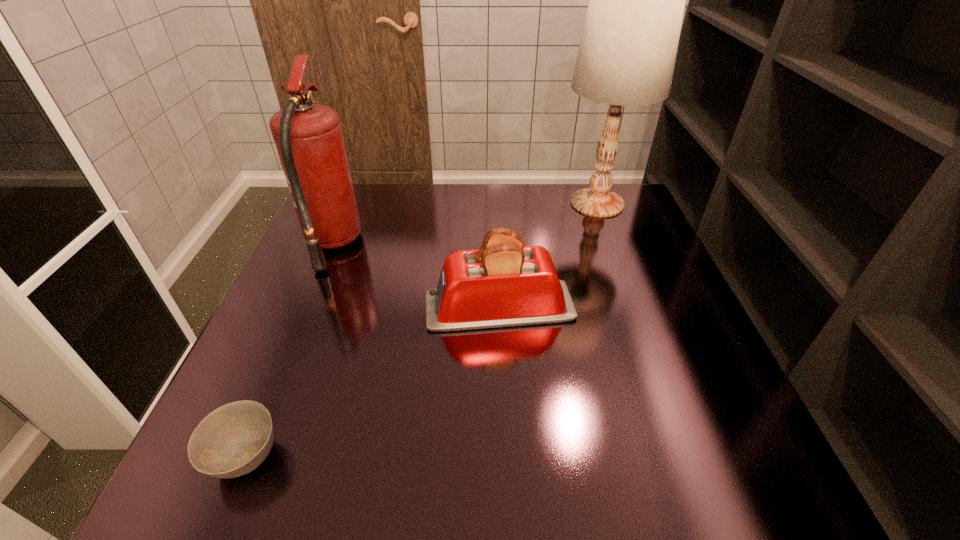
Find the location of a particular element. Image resolution: width=960 pixels, height=540 pixels. the tallest object is located at coordinates (628, 48).

Where is `the rightmost object`? Image resolution: width=960 pixels, height=540 pixels. the rightmost object is located at coordinates (628, 48).

You are a GUI agent. You are given a task and a screenshot of the screen. Output one action in this format:
    pyautogui.click(x=<x>, y=<y>)
    Task: Click on the fire extinguisher
    
    Given the screenshot: What is the action you would take?
    pyautogui.click(x=308, y=137)

The height and width of the screenshot is (540, 960). I want to click on the third farthest object, so click(x=503, y=284).

Where is `the third tallest object`? Image resolution: width=960 pixels, height=540 pixels. the third tallest object is located at coordinates (503, 284).

This screenshot has width=960, height=540. Identify the location of the shortest object. (233, 440).

Identify the location of bowl. Image resolution: width=960 pixels, height=540 pixels. (233, 440).

Locate an element on the screen. This screenshot has width=960, height=540. vacant space located 0.180m on the left of the tallest object is located at coordinates (495, 203).

The image size is (960, 540). I want to click on vacant space positioned 0.210m at the front of the second tallest object where the nozzle is aimed, so click(x=441, y=244).

The width and height of the screenshot is (960, 540). Find the location of `vacant area located on the left of the toaster`. vacant area located on the left of the toaster is located at coordinates (316, 307).